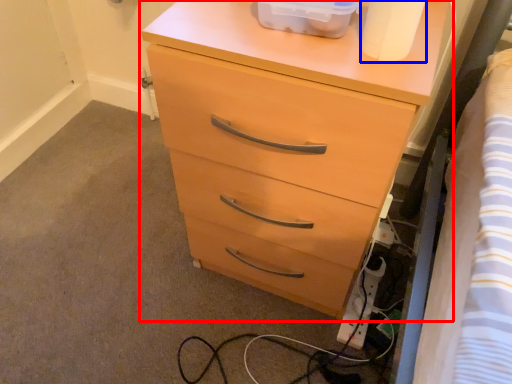
Question: Which object is further to the camera taking this photo, chest of drawers (highlighted by a red box) or toilet paper (highlighted by a blue box)?

Choices:
 (A) chest of drawers
 (B) toilet paper

Answer: (A)